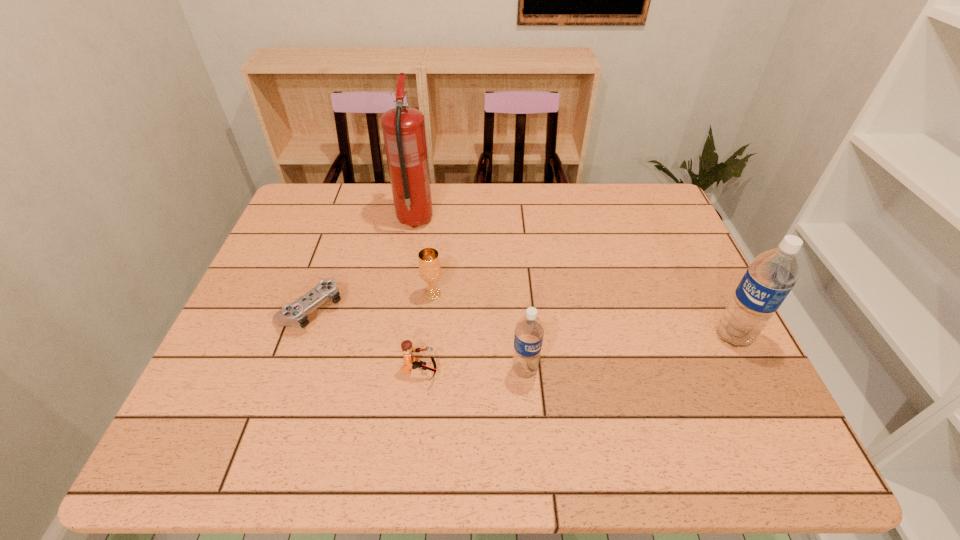
Identify the location of the shorter water bottle. (529, 331).

Find the location of a particular element. The image size is (960, 540). the nearer water bottle is located at coordinates (529, 331).

At what (x,y) coordinates should I click in order to perform the action: click on the fifth shortest object. Please return your answer as a coordinate pair (x, y). The width and height of the screenshot is (960, 540). Looking at the image, I should click on (771, 276).

Locate an element on the screen. the taller water bottle is located at coordinates (771, 276).

Find the location of `fire extinguisher`. fire extinguisher is located at coordinates coord(403,127).

Find the location of `the tallest object`. the tallest object is located at coordinates (403, 127).

Identify the location of the third shortest object. (429, 263).

In order to click on the second shortest object in this screenshot , I will do `click(410, 362)`.

Locate an element on the screen. The height and width of the screenshot is (540, 960). control is located at coordinates click(x=294, y=314).

You are a GUI agent. You are given a task and a screenshot of the screen. Output one action in this format:
    pyautogui.click(x=<x>, y=<y>)
    Task: Click on the leftmost object
    The width and height of the screenshot is (960, 540).
    Given the screenshot: What is the action you would take?
    pyautogui.click(x=294, y=314)